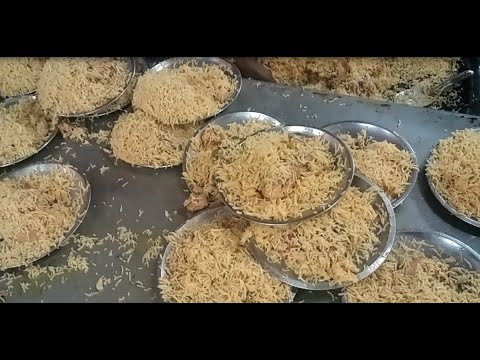
You are a GUI agent. You are given a task and a screenshot of the screen. Output one action in this format:
    pyautogui.click(x=<x>, y=<y>)
    Task: Click on the metal work surface
    The image size is (480, 360).
    Given the screenshot: What is the action you would take?
    pyautogui.click(x=144, y=189), pyautogui.click(x=283, y=112), pyautogui.click(x=416, y=215)